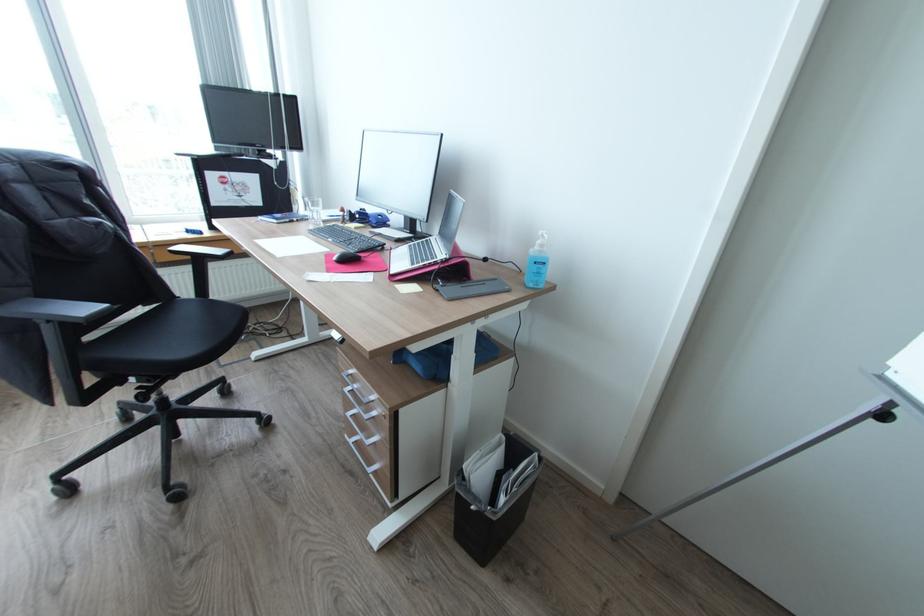
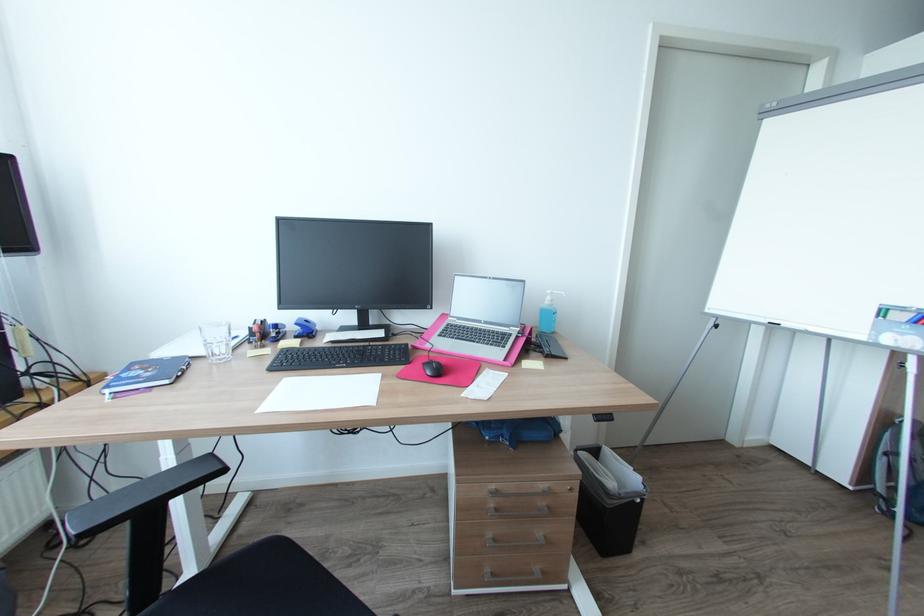
Find the pixel in the second image that matches point 362,216 in the first image.

(277, 331)